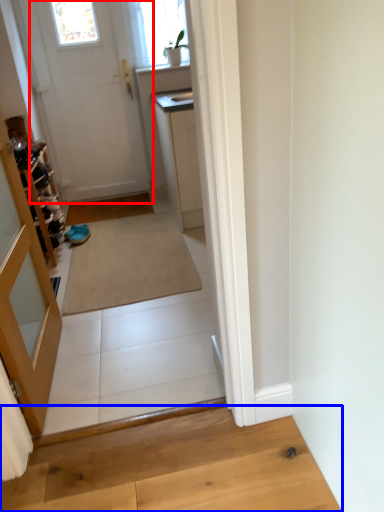
Question: Which object appears farthest to the camera in this image, door (highlighted by a red box) or hardwood (highlighted by a blue box)?

Choices:
 (A) door
 (B) hardwood

Answer: (A)